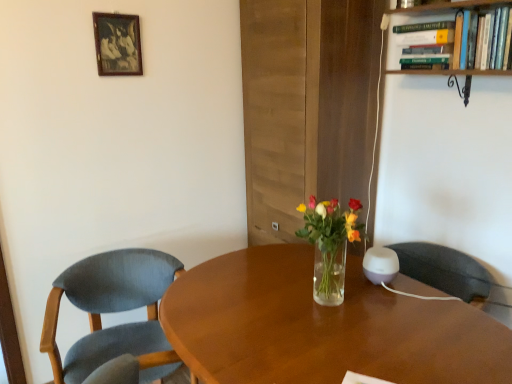
Measure the distance between point (54, 344) and camera.

They are 1.62 meters apart.

I want to click on textured blue fabric chair at left, so click(112, 312).

Identify the location of wooden desk at center. This screenshot has width=512, height=384. (322, 326).

This screenshot has height=384, width=512. What are the coordinates of `wooden bookshelf at upper right` in the screenshot? It's located at (448, 7).

In order to face wooden bookshelf at upper right, should I rotate leftwards or rightwards?

To align with it, rotate right about 25.268°.

This screenshot has height=384, width=512. What do you see at coordinates (426, 44) in the screenshot? I see `green hardcover book at upper right` at bounding box center [426, 44].

I want to click on textured blue fabric chair at left, so click(112, 312).

Which object is closer to the camera taking this photo, clear glass vase at center or green hardcover book at upper right?

clear glass vase at center is more forward.

Which object is positioned more to the right, clear glass vase at center or green hardcover book at upper right?

From the viewer's perspective, green hardcover book at upper right appears more on the right side.

Would you say clear glass vase at center contains green hardcover book at upper right?

Actually, green hardcover book at upper right is outside clear glass vase at center.

How much distance is there between clear glass vase at center and wooden desk at center?

29.13 centimeters.

Is clear glass vase at center thinner than wooden desk at center?

Correct, the width of clear glass vase at center is less than that of wooden desk at center.

Would you say wooden desk at center is part of clear glass vase at center's contents?

No, wooden desk at center is not surrounded by clear glass vase at center.

Where is `floral arrangement to the left of wooden desk at center`? floral arrangement to the left of wooden desk at center is located at coordinates (330, 244).

Is wooden desk at center at the left side of wooden picture frame at upper left?

No, wooden desk at center is not to the left of wooden picture frame at upper left.

From a real-world perspective, which object rests below the other?

In real-world perspective, wooden desk at center is lower.

Locate an element on the screen. Image resolution: width=512 pixels, height=384 pixels. desk beneath the wooden picture frame at upper left (from a real-world perspective) is located at coordinates (322, 326).

Is wooden desk at center completely or partially outside of wooden picture frame at upper left?

wooden desk at center is positioned outside wooden picture frame at upper left.

How many degrees apart are the facing directions of green hardcover book at upper right and wooden bookshelf at upper right?

The facing directions of green hardcover book at upper right and wooden bookshelf at upper right are 0.386 degrees apart.

Identify the location of book located behind the wooden bookshelf at upper right. (426, 44).

From the picture: Is green hardcover book at upper right thinner than wooden bookshelf at upper right?

No.

Does point (442, 55) come closer to viewer compared to point (414, 8)?

Yes, it is.

How distant is green hardcover book at upper right from wooden picture frame at upper left?

A distance of 1.26 meters exists between green hardcover book at upper right and wooden picture frame at upper left.

From the image's perspective, which one is positioned higher, green hardcover book at upper right or wooden picture frame at upper left?

wooden picture frame at upper left is shown above in the image.

Is the surface of green hardcover book at upper right in direct contact with wooden picture frame at upper left?

No, green hardcover book at upper right is not next to wooden picture frame at upper left.

Which object is further away from the camera, green hardcover book at upper right or wooden picture frame at upper left?

wooden picture frame at upper left is further from the camera.

Does wooden desk at center have a greater height compared to textured blue fabric chair at left?

No.

Is wooden desk at center facing away from textured blue fabric chair at left?

wooden desk at center is not turned away from textured blue fabric chair at left.

What's the angular difference between wooden desk at center and textured blue fabric chair at left's facing directions?

There is a 75.4-degree angle between the facing directions of wooden desk at center and textured blue fabric chair at left.

Which is more to the left, wooden desk at center or textured blue fabric chair at left?

textured blue fabric chair at left.

From a real-world perspective, is textured blue fabric chair at left beneath wooden picture frame at upper left?

Yes, from a real-world perspective, textured blue fabric chair at left is under wooden picture frame at upper left.

Is point (81, 305) closer to viewer compared to point (133, 34)?

Yes, point (81, 305) is closer to viewer.

Which object is positioned more to the right, textured blue fabric chair at left or wooden picture frame at upper left?

textured blue fabric chair at left.

Is textured blue fabric chair at left positioned before wooden picture frame at upper left?

Yes, textured blue fabric chair at left is closer to the camera.

At what (x,y) coordinates should I click in order to perform the action: click on floral arrangement lying below the green hardcover book at upper right (from the image's perspective). Please return your answer as a coordinate pair (x, y). This screenshot has height=384, width=512. Looking at the image, I should click on (330, 244).

What are the coordinates of `floral arrangement to the left of wooden desk at center` in the screenshot? It's located at (330, 244).

Looking at the image, which one is located further to wooden bookshelf at upper right, clear glass vase at center or textured blue fabric chair at left?

Among the two, textured blue fabric chair at left is located further to wooden bookshelf at upper right.

Estimate the real-world distances between objects in this image. Which object is further from clear glass vase at center, green hardcover book at upper right or textured blue fabric chair at left?

Among the two, green hardcover book at upper right is located further to clear glass vase at center.

Looking at the image, which one is located closer to clear glass vase at center, wooden desk at center or green hardcover book at upper right?

The object closer to clear glass vase at center is wooden desk at center.

Considering their positions, is wooden desk at center positioned closer to green hardcover book at upper right than wooden picture frame at upper left?

wooden desk at center is closer to green hardcover book at upper right.

Looking at the image, which one is located further to wooden bookshelf at upper right, textured blue fabric chair at left or green hardcover book at upper right?

textured blue fabric chair at left is further to wooden bookshelf at upper right.

From the image, which object appears to be farther from textured blue fabric chair at left, wooden bookshelf at upper right or wooden picture frame at upper left?

wooden bookshelf at upper right is positioned further to the anchor textured blue fabric chair at left.

Estimate the real-world distances between objects in this image. Which object is further from green hardcover book at upper right, wooden desk at center or wooden bookshelf at upper right?

wooden desk at center is further to green hardcover book at upper right.

Looking at this image, considering their positions, is wooden bookshelf at upper right positioned closer to green hardcover book at upper right than clear glass vase at center?

wooden bookshelf at upper right.

You are a GUI agent. You are given a task and a screenshot of the screen. Output one action in this format:
    pyautogui.click(x=<x>, y=<y>)
    Task: Click on the floral arrangement between wooden picture frame at upper left and wooden bookshelf at upper right from left to right
    This screenshot has width=512, height=384.
    Given the screenshot: What is the action you would take?
    pyautogui.click(x=330, y=244)

Find the location of a particular element. The height and width of the screenshot is (384, 512). chair between wooden picture frame at upper left and wooden desk at center is located at coordinates (x=112, y=312).

Find the location of `book located between wooden picture frame at upper left and wooden bookshelf at upper right in the left-right direction`. book located between wooden picture frame at upper left and wooden bookshelf at upper right in the left-right direction is located at coordinates (426, 44).

Identify the location of desk between wooden picture frame at upper left and wooden bookshelf at upper right. The width and height of the screenshot is (512, 384). (322, 326).